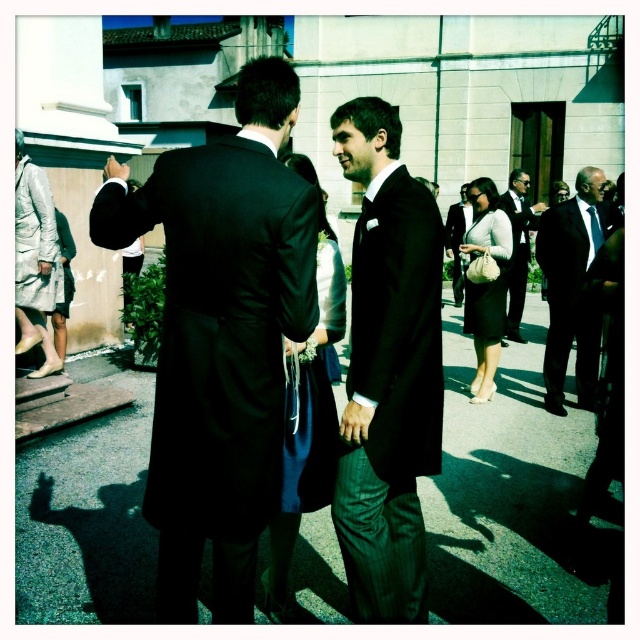
Does smooth asphalt pavement at center have a smaller size compared to matte black dress at center?

Yes.

Can you confirm if smooth asphalt pavement at center is positioned above matte black dress at center?

No, smooth asphalt pavement at center is not above matte black dress at center.

Which is in front, point (556, 609) or point (493, 291)?

Point (556, 609)

Find the location of a particular element. This screenshot has height=640, width=640. smooth asphalt pavement at center is located at coordinates (506, 496).

Consider the image. Can you confirm if matte black suit at left is wider than black pinstripe suit at center?

Yes.

Which of these two, matte black suit at left or black pinstripe suit at center, stands shorter?

Standing shorter between the two is black pinstripe suit at center.

I want to click on matte black suit at left, so click(x=220, y=337).

Which is below, matte black suit at left or silky blue dress at center?

silky blue dress at center is below.

Looking at this image, does matte black suit at left appear on the right side of silky blue dress at center?

In fact, matte black suit at left is to the left of silky blue dress at center.

This screenshot has width=640, height=640. Describe the element at coordinates (220, 337) in the screenshot. I see `matte black suit at left` at that location.

This screenshot has height=640, width=640. Identify the location of matte black suit at left. (220, 337).